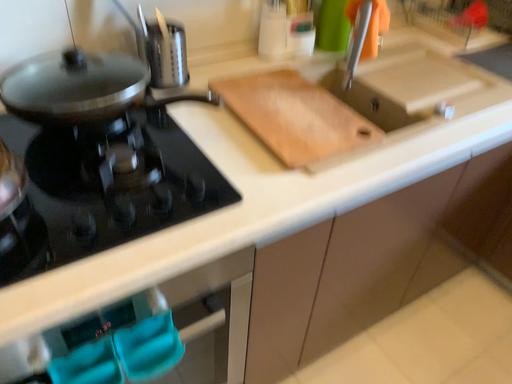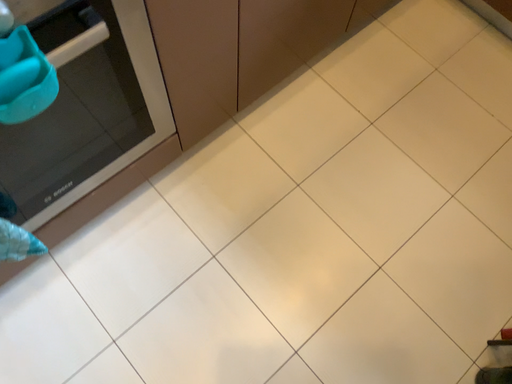
Question: Which way did the camera rotate in the video?

Choices:
 (A) rotated downward
 (B) rotated upward

Answer: (A)